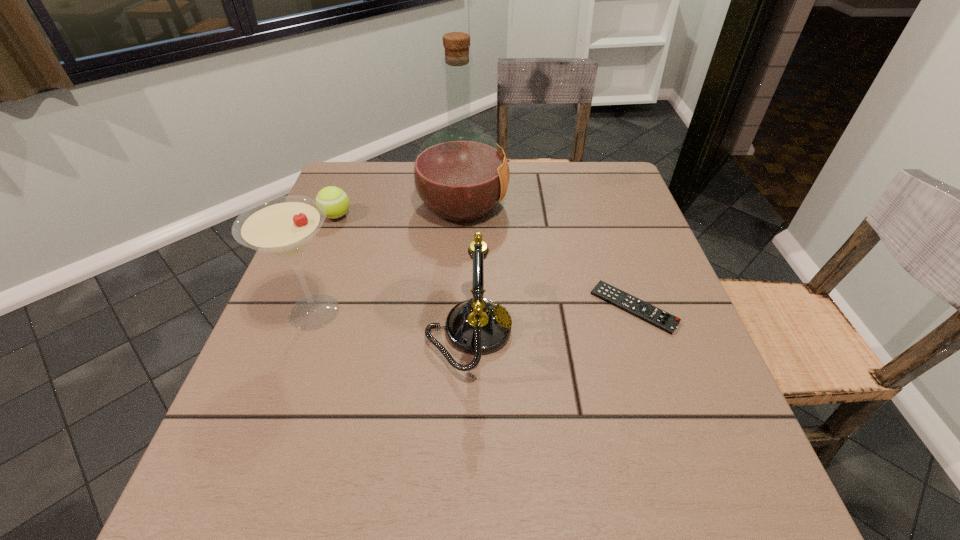
Find the location of a particular element. This screenshot has height=540, width=960. free region at the right edge is located at coordinates (615, 273).

Where is `vacant position at the far left corner of the desktop`? The height and width of the screenshot is (540, 960). vacant position at the far left corner of the desktop is located at coordinates (370, 182).

This screenshot has height=540, width=960. I want to click on blank area at the near left corner, so click(x=245, y=531).

This screenshot has height=540, width=960. I want to click on vacant space at the far right corner of the desktop, so click(x=596, y=185).

Locate an element on the screen. This screenshot has height=540, width=960. unoccupied position between the fourth tallest object and the telephone is located at coordinates (402, 274).

Identify the location of free point between the remote control and the telephone. (551, 320).

Where is `free space between the shortest object and the third shortest object`? Image resolution: width=960 pixels, height=540 pixels. free space between the shortest object and the third shortest object is located at coordinates (551, 320).

I want to click on vacant space in between the martini and the telephone, so point(392,322).

Locate an element on the screen. free space between the fourth tallest object and the tallest object is located at coordinates (399, 211).

The image size is (960, 540). Find the location of `free spot between the third tallest object and the tallest object`. free spot between the third tallest object and the tallest object is located at coordinates (466, 269).